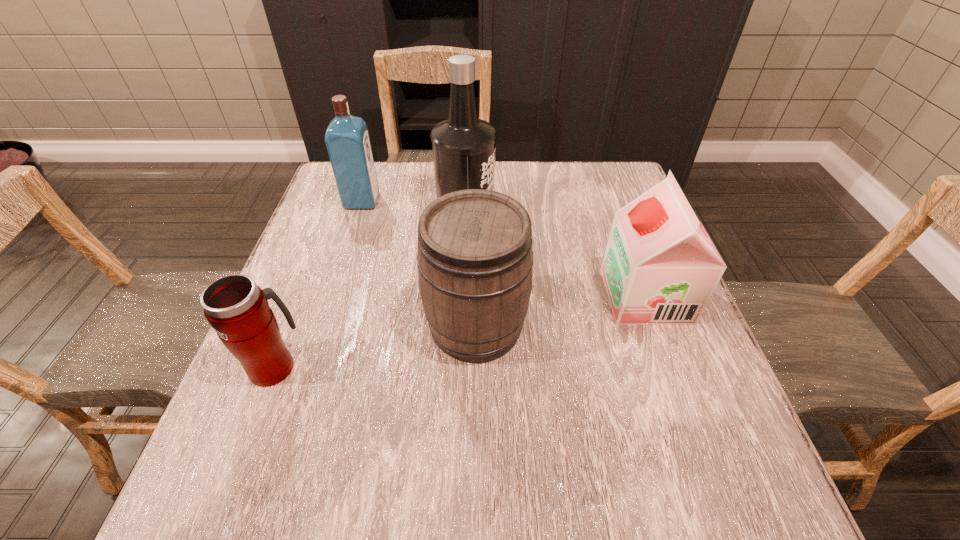
Locate an element on the screen. The image size is (960, 540). vacant area that lies between the thermos bottle and the tallest object is located at coordinates (371, 290).

Find the location of a particular element. The image size is (960, 540). empty space between the rightmost object and the right liquor is located at coordinates (556, 255).

At what (x,y) coordinates should I click in order to perform the action: click on object identified as the fourth closest to the wine bucket. Please return your answer as a coordinate pair (x, y). The height and width of the screenshot is (540, 960). Looking at the image, I should click on point(347,139).

Locate an element on the screen. The height and width of the screenshot is (540, 960). the third closest object to the left liquor is located at coordinates (238, 309).

Locate an element on the screen. vacant area that satisfies the following two spatial constraints: 1. on the flat label side of the shorter liquor; 2. on the left side of the wine bucket is located at coordinates (322, 325).

Where is `free location that satisfies the following two spatial constraints: 1. on the front label of the tallest object; 2. on the back side of the wine bucket`? The height and width of the screenshot is (540, 960). free location that satisfies the following two spatial constraints: 1. on the front label of the tallest object; 2. on the back side of the wine bucket is located at coordinates (462, 325).

This screenshot has width=960, height=540. I want to click on vacant position in the image that satisfies the following two spatial constraints: 1. on the side with the handle of the shortest object; 2. on the left side of the wine bucket, so click(291, 325).

At what (x,y) coordinates should I click in order to perform the action: click on free spot that satisfies the following two spatial constraints: 1. on the side with the handle of the thermos bottle; 2. on the right side of the wine bucket. Please return your answer as a coordinate pair (x, y). This screenshot has height=540, width=960. Looking at the image, I should click on (291, 325).

I want to click on free space that satisfies the following two spatial constraints: 1. on the flat label side of the wine bucket; 2. on the left side of the shorter liquor, so click(322, 325).